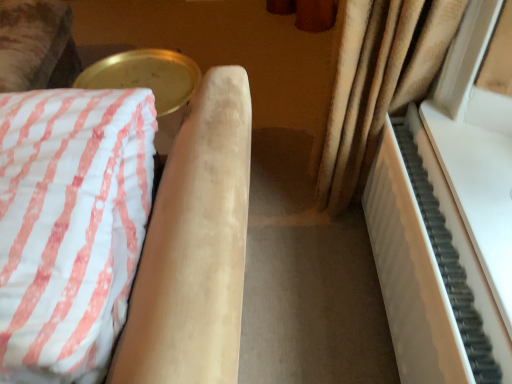
What do you see at coordinates (69, 228) in the screenshot? The height and width of the screenshot is (384, 512). I see `velvet beige armchair at left` at bounding box center [69, 228].

Measure the distance between point (18, 330) and camera.

The depth of point (18, 330) is 22.56 inches.

Identify the location of velvet beige armchair at left. The height and width of the screenshot is (384, 512). 69,228.

Where is `white matte piano at right`? This screenshot has height=384, width=512. white matte piano at right is located at coordinates (430, 267).

Measure the distance between white matte piano at right and camera.

white matte piano at right and camera are 28.26 inches apart.

This screenshot has height=384, width=512. Describe the element at coordinates (430, 267) in the screenshot. I see `white matte piano at right` at that location.

Identify the location of velvet beige armchair at left. [x=69, y=228].

Looking at this image, is white matte piano at right at the right side of velvet beige armchair at left?

Correct, you'll find white matte piano at right to the right of velvet beige armchair at left.

Is white matte piano at right in front of or behind velvet beige armchair at left in the image?

Clearly, white matte piano at right is behind velvet beige armchair at left.

Is point (384, 129) closer to viewer compared to point (110, 191)?

No, (384, 129) is further to viewer.

From the image's perspective, is white matte piano at right located above or below velvet beige armchair at left?

Clearly, from the image's perspective, white matte piano at right is below velvet beige armchair at left.

From a real-world perspective, between white matte piano at right and velvet beige armchair at left, who is vertically lower?

white matte piano at right is physically lower.

Is white matte piano at right wider than velvet beige armchair at left?

In fact, white matte piano at right might be narrower than velvet beige armchair at left.

Which of these two, white matte piano at right or velvet beige armchair at left, stands shorter?

white matte piano at right.

Is white matte piano at right bigger than velvet beige armchair at left?

Incorrect, white matte piano at right is not larger than velvet beige armchair at left.

Is white matte piano at right spatially inside velvet beige armchair at left, or outside of it?

white matte piano at right is located beyond the bounds of velvet beige armchair at left.

Is white matte piano at right far from velvet beige armchair at left?

Actually, white matte piano at right and velvet beige armchair at left are a little close together.

Is white matte piano at right looking in the opposite direction of velvet beige armchair at left?

white matte piano at right is not turned away from velvet beige armchair at left.

In the scene shown: Can you tell me how much white matte piano at right and velvet beige armchair at left differ in facing direction?

white matte piano at right and velvet beige armchair at left are facing 90.4 degrees away from each other.

In order to click on piano below the velvet beige armchair at left (from the image's perspective) in this screenshot , I will do `click(430, 267)`.

Does velvet beige armchair at left appear on the left side of white matte piano at right?

Yes, velvet beige armchair at left is to the left of white matte piano at right.

Is velvet beige armchair at left further to the viewer compared to white matte piano at right?

No, it is in front of white matte piano at right.

Between point (194, 105) and point (374, 233), which one is positioned in front?

Positioned in front is point (194, 105).

Looking at this image, from the image's perspective, does velvet beige armchair at left appear lower than white matte piano at right?

Actually, velvet beige armchair at left appears above white matte piano at right in the image.

From a real-world perspective, is velvet beige armchair at left positioned over white matte piano at right based on gravity?

Yes.

Is velvet beige armchair at left wider or thinner than white matte piano at right?

velvet beige armchair at left is wider than white matte piano at right.

Is velvet beige armchair at left shorter than white matte piano at right?

No, velvet beige armchair at left is not shorter than white matte piano at right.

Considering the relative sizes of velvet beige armchair at left and white matte piano at right in the image provided, is velvet beige armchair at left smaller than white matte piano at right?

Incorrect, velvet beige armchair at left is not smaller in size than white matte piano at right.

Could white matte piano at right be considered to be inside velvet beige armchair at left?

No, white matte piano at right is not inside velvet beige armchair at left.

In the scene shown: Is velvet beige armchair at left not near white matte piano at right?

No, velvet beige armchair at left is not far from white matte piano at right.

Is velvet beige armchair at left turned away from white matte piano at right?

No.

Can you tell me how much velvet beige armchair at left and white matte piano at right differ in facing direction?

There is a 90.4-degree angle between the facing directions of velvet beige armchair at left and white matte piano at right.

What are the coordinates of `furniture that appears on the left of white matte piano at right` in the screenshot? It's located at (69, 228).

You are a GUI agent. You are given a task and a screenshot of the screen. Output one action in this format:
    pyautogui.click(x=<x>, y=<y>)
    Task: Click on the furniture that appears in front of the white matte piano at right
    
    Given the screenshot: What is the action you would take?
    pyautogui.click(x=69, y=228)

The height and width of the screenshot is (384, 512). What are the coordinates of `furniture above the white matte piano at right (from the image's perspective)` in the screenshot? It's located at (69, 228).